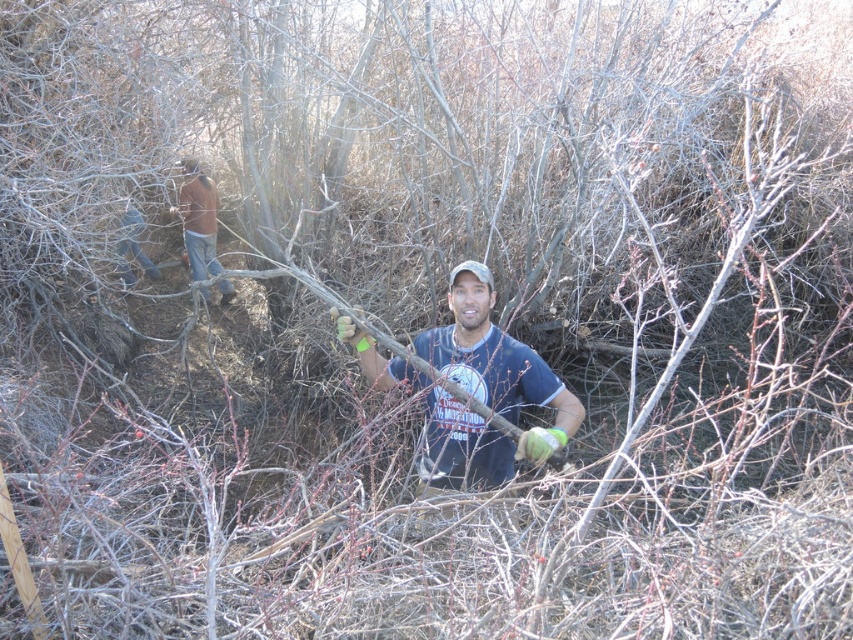
This screenshot has height=640, width=853. I want to click on brown leather jacket at upper left, so click(x=198, y=220).

Does brown leather jacket at upper left appear over denim jeans at left?

Yes.

Is point (210, 262) less distant than point (122, 252)?

No.

You are a GUI agent. You are given a task and a screenshot of the screen. Output one action in this format:
    pyautogui.click(x=<x>, y=<y>)
    Task: Click on the brown leather jacket at upper left
    
    Given the screenshot: What is the action you would take?
    pyautogui.click(x=198, y=220)

Which is more to the left, dark blue t-shirt at center or denim jeans at left?

Positioned to the left is denim jeans at left.

Does point (495, 433) lie in front of point (128, 221)?

Yes, point (495, 433) is in front of point (128, 221).

Where is `dark blue t-shirt at center`? The image size is (853, 640). dark blue t-shirt at center is located at coordinates (473, 388).

Can you confirm if dark blue t-shirt at center is positioned to the left of brown leather jacket at upper left?

Incorrect, dark blue t-shirt at center is not on the left side of brown leather jacket at upper left.

Does dark blue t-shirt at center have a lesser height compared to brown leather jacket at upper left?

Yes, dark blue t-shirt at center is shorter than brown leather jacket at upper left.

Which is in front, point (518, 380) or point (202, 205)?

Point (518, 380)

The height and width of the screenshot is (640, 853). In order to click on dark blue t-shirt at center in this screenshot , I will do `click(473, 388)`.